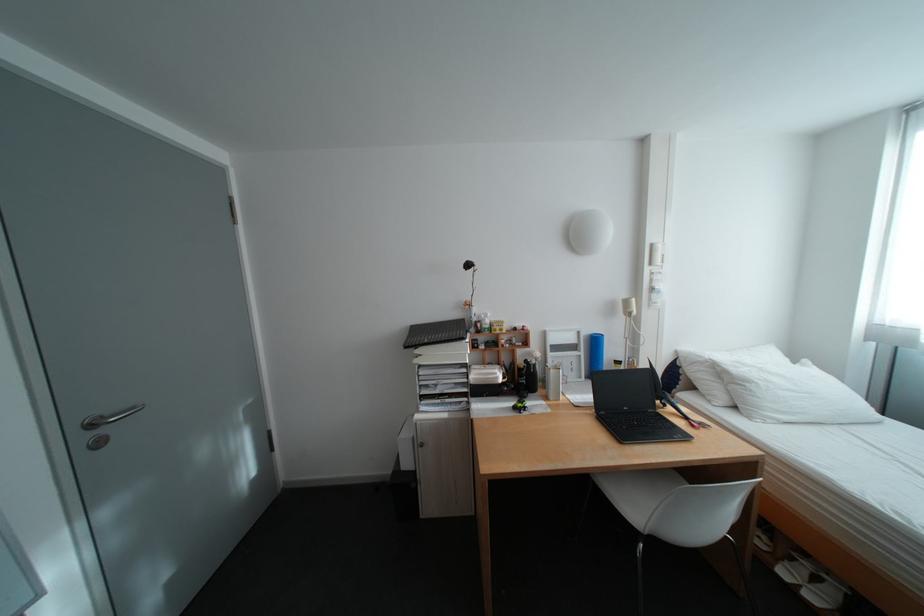
Locate an element on the screen. chair sitting surface is located at coordinates (638, 492).